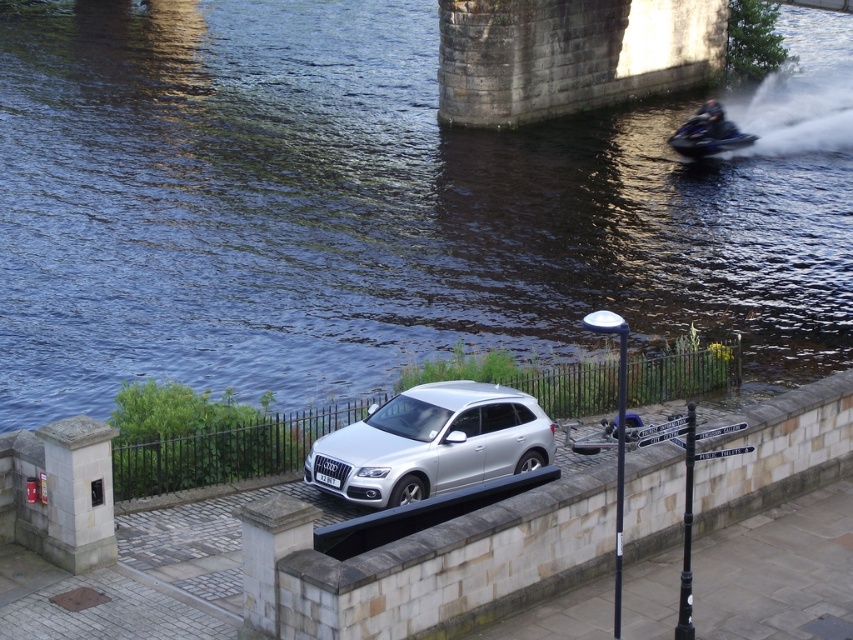
Question: Which object appears farthest from the camera in this image?

Choices:
 (A) satin silver suv at center
 (B) dark blue water at center
 (C) blue metallic jet ski at upper right

Answer: (C)

Question: Is dark blue water at center in front of satin silver suv at center?

Choices:
 (A) no
 (B) yes

Answer: (A)

Question: Which object appears farthest from the camera in this image?

Choices:
 (A) satin silver suv at center
 (B) dark blue water at center
 (C) blue metallic jet ski at upper right

Answer: (C)

Question: Is dark blue water at center in front of blue metallic jet ski at upper right?

Choices:
 (A) no
 (B) yes

Answer: (B)

Question: Can you confirm if dark blue water at center is positioned above satin silver suv at center?

Choices:
 (A) no
 (B) yes

Answer: (B)

Question: Which point is farther to the camera?

Choices:
 (A) (683, 125)
 (B) (341, 465)

Answer: (A)